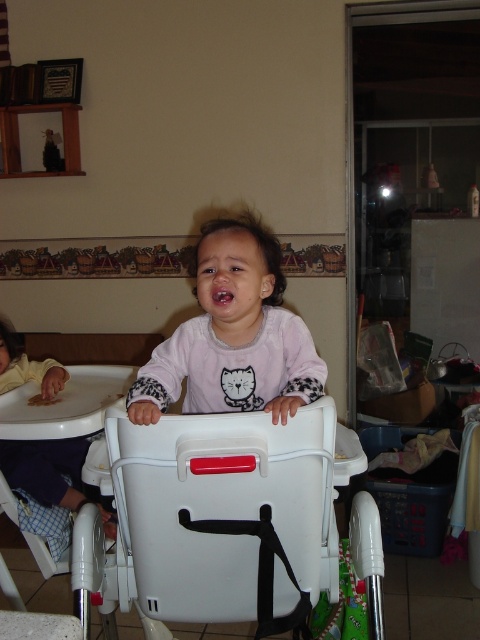
Can you confirm if pink matte shirt at center is positioned below purple soft baby at left?

No.

Does pink matte shirt at center appear on the right side of purple soft baby at left?

Correct, you'll find pink matte shirt at center to the right of purple soft baby at left.

Is point (227, 349) positioned before point (1, 381)?

That is True.

Image resolution: width=480 pixels, height=640 pixels. I want to click on pink matte shirt at center, so click(233, 336).

Can you confirm if white plastic baby carriage at center is wider than pink matte shirt at center?

Yes, white plastic baby carriage at center is wider than pink matte shirt at center.

Who is more forward, (147, 490) or (278, 385)?

Positioned in front is point (147, 490).

Find the location of a particular element. The height and width of the screenshot is (640, 480). white plastic baby carriage at center is located at coordinates (216, 518).

Is white plastic baby carriage at center positioned at the back of purple soft baby at left?

No.

Which of these two, white plastic baby carriage at center or purple soft baby at left, stands taller?

white plastic baby carriage at center is taller.

Image resolution: width=480 pixels, height=640 pixels. I want to click on white plastic baby carriage at center, so click(216, 518).